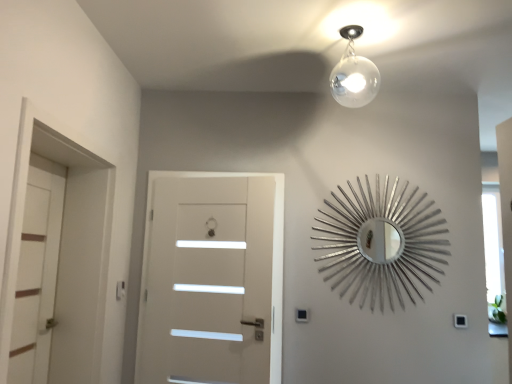
Question: Is white matte door at center, which is the first door from right to left, next to black plastic light switch at lower right?

Choices:
 (A) yes
 (B) no

Answer: (B)

Question: Can you confirm if white matte door at center, the second door positioned from the left, is positioned to the right of black plastic light switch at lower right?

Choices:
 (A) yes
 (B) no

Answer: (B)

Question: Is white matte door at center, the second door positioned from the left, outside black plastic light switch at lower right?

Choices:
 (A) no
 (B) yes

Answer: (B)

Question: From a real-world perspective, is white matte door at center, which is the first door from right to left, beneath black plastic light switch at lower right?

Choices:
 (A) yes
 (B) no

Answer: (B)

Question: From a real-world perspective, is white matte door at center, the second door positioned from the left, physically above black plastic light switch at lower right?

Choices:
 (A) no
 (B) yes

Answer: (B)

Question: Which is correct: black plastic light switch at lower right is inside white matte door at left, marked as the 2th door in a right-to-left arrangement, or outside of it?

Choices:
 (A) outside
 (B) inside

Answer: (A)

Question: From a real-world perspective, is black plastic light switch at lower right physically located above or below white matte door at left, marked as the 2th door in a right-to-left arrangement?

Choices:
 (A) above
 (B) below

Answer: (B)

Question: Considering their positions, is black plastic light switch at lower right located in front of or behind white matte door at left, marked as the 1th door in a left-to-right arrangement?

Choices:
 (A) behind
 (B) front

Answer: (A)

Question: Is point (457, 314) closer or farther from the camera than point (52, 263)?

Choices:
 (A) farther
 (B) closer

Answer: (A)

Question: Visually, is silver metallic sunburst mirror at upper right positioned to the left or to the right of white matte door at left, marked as the 2th door in a right-to-left arrangement?

Choices:
 (A) left
 (B) right

Answer: (B)

Question: Is silver metallic sunburst mirror at upper right situated inside white matte door at left, marked as the 2th door in a right-to-left arrangement, or outside?

Choices:
 (A) inside
 (B) outside

Answer: (B)

Question: Is point (348, 276) closer or farther from the camera than point (16, 380)?

Choices:
 (A) farther
 (B) closer

Answer: (A)

Question: From the image's perspective, is silver metallic sunburst mirror at upper right above or below white matte door at left, marked as the 2th door in a right-to-left arrangement?

Choices:
 (A) above
 (B) below

Answer: (A)

Question: Is white matte door at left, marked as the 1th door in a left-to-right arrangement, inside or outside of black plastic light switch at lower right?

Choices:
 (A) inside
 (B) outside

Answer: (B)

Question: From a real-world perspective, is white matte door at left, marked as the 1th door in a left-to-right arrangement, above or below black plastic light switch at lower right?

Choices:
 (A) below
 (B) above

Answer: (B)